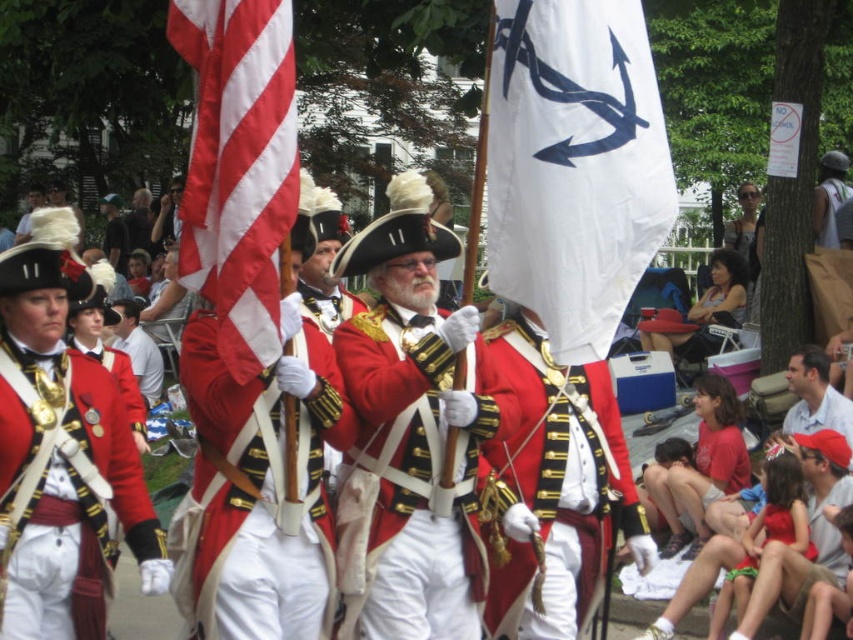
You are a costume designer examining the historical military uniforms in the image. Which object at the center has a smaller width between the shiny gold buttons at center and the shiny gold medallion at center?

The shiny gold buttons at center has a lesser width compared to the shiny gold medallion at center, so the shiny gold buttons at center is smaller in width.

You are an observer standing at the origin point of the coordinate system. Where is the matte gold chain at center located in terms of coordinates?

The matte gold chain at center is located at coordinates point (70, 481).